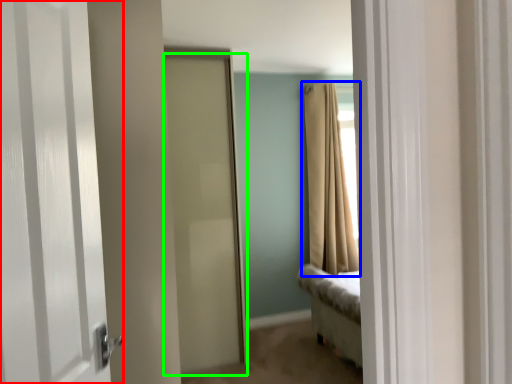
Question: Which object is positioned closest to door (highlighted by a red box)? Select from curtain (highlighted by a blue box) and door (highlighted by a green box).

Choices:
 (A) curtain
 (B) door

Answer: (B)